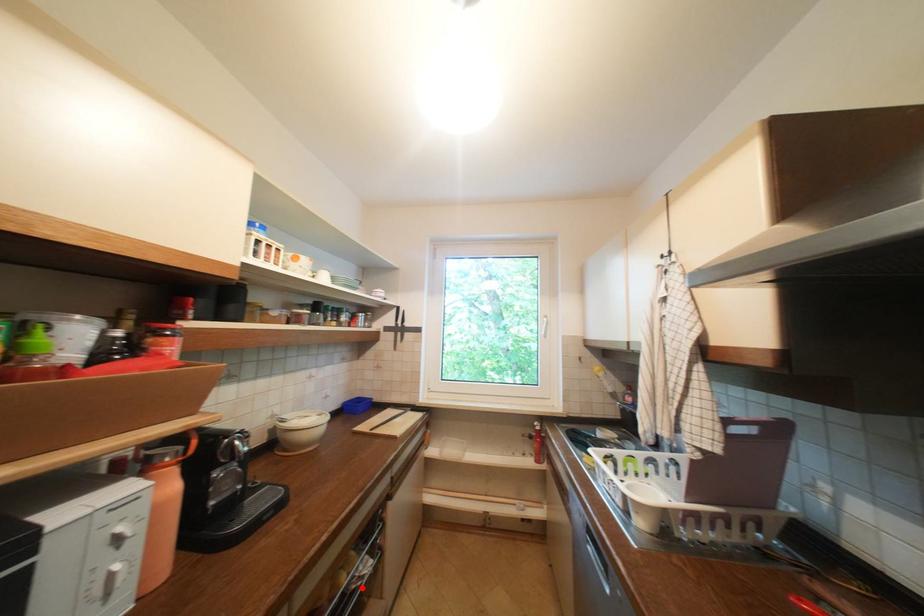
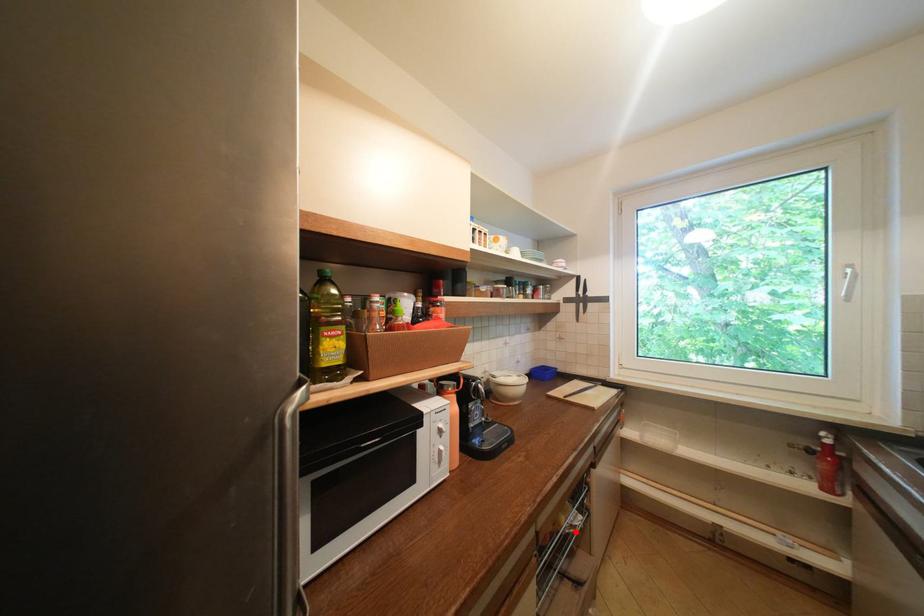
I am providing you with two images of the same scene from different viewpoints. A red point is marked on the first image and another point is marked on the second image. Are the points marked in image1 and image2 representing the same 3D position?

Yes